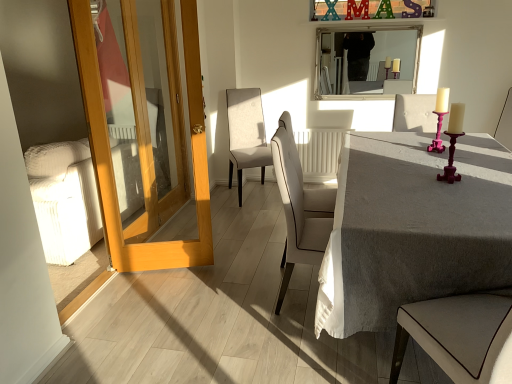
The width and height of the screenshot is (512, 384). Identify the location of free space in front of light wood door at left. (116, 310).